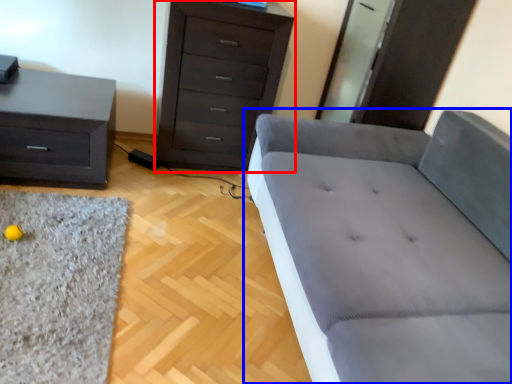
Question: Which point is further to the camera, chest of drawers (highlighted by a red box) or studio couch (highlighted by a blue box)?

Choices:
 (A) chest of drawers
 (B) studio couch

Answer: (A)